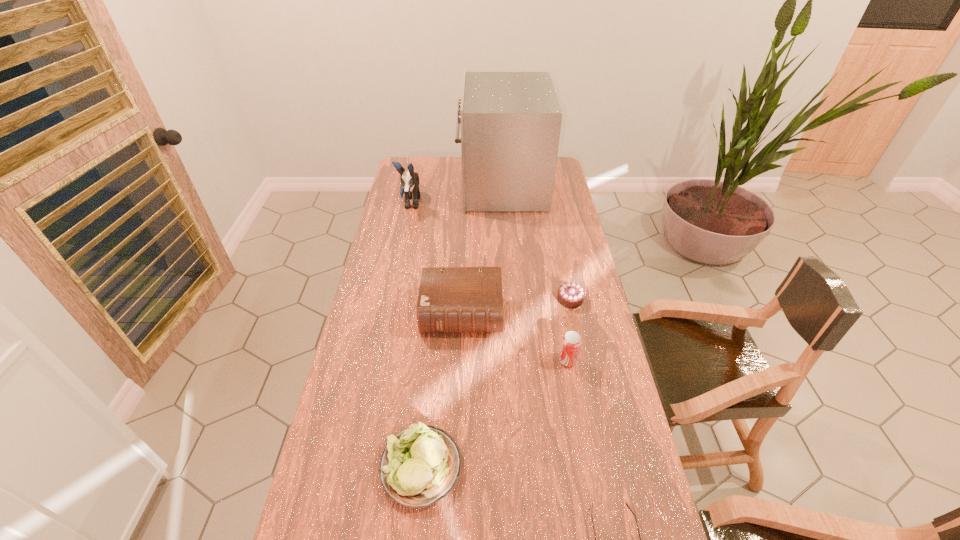
Locate an element on the screen. The height and width of the screenshot is (540, 960). the tallest object is located at coordinates (510, 122).

Where is `the leftmost object`? the leftmost object is located at coordinates (410, 181).

Locate an element on the screen. Image resolution: width=960 pixels, height=540 pixels. puppy is located at coordinates (410, 181).

Where is `Bible`? Bible is located at coordinates (451, 299).

At what (x,y) coordinates should I click in order to perform the action: click on soda can. Please return your answer as a coordinate pair (x, y). The image size is (960, 540). Looking at the image, I should click on (571, 342).

Locate an element on the screen. This screenshot has width=960, height=540. the fifth tallest object is located at coordinates (420, 465).

You are a GUI agent. You are given a task and a screenshot of the screen. Output one action in this format:
    pyautogui.click(x=<x>, y=<y>)
    Task: Click on the chocolate cake
    
    Given the screenshot: What is the action you would take?
    pyautogui.click(x=571, y=295)

You are a GUI agent. You are given a task and a screenshot of the screen. Output one action in this format:
    pyautogui.click(x=<x>, y=<y>)
    Task: Click on the vacant space located 0.280m on the front panel of the tallest object
    
    Given the screenshot: What is the action you would take?
    pyautogui.click(x=400, y=186)

Find the location of `free location located on the front panel of the tallest object`. free location located on the front panel of the tallest object is located at coordinates (396, 186).

Image resolution: width=960 pixels, height=540 pixels. What are the coordinates of `vacant space located on the front panel of the tallest object` in the screenshot? It's located at 417,186.